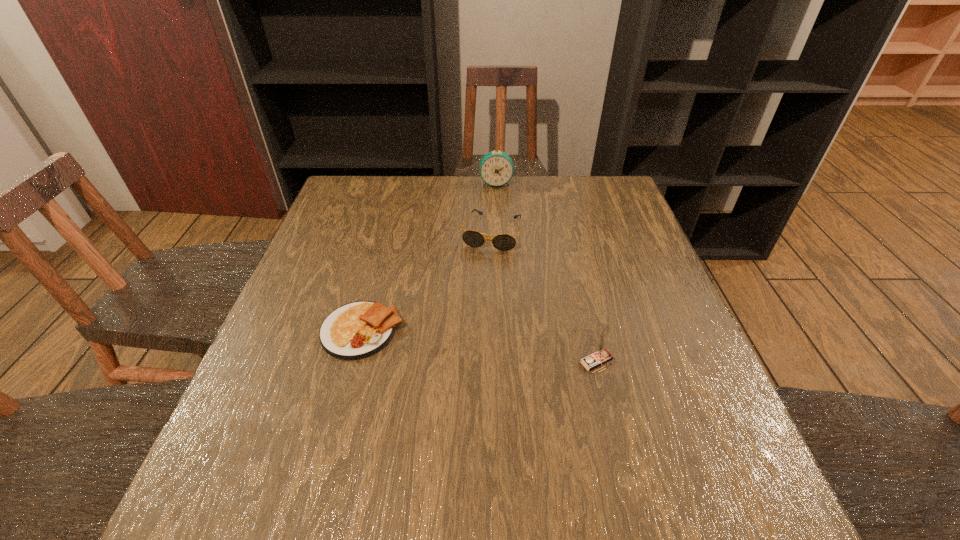
Locate an element on the screen. free area in between the farthest object and the shortest object is located at coordinates (429, 257).

The height and width of the screenshot is (540, 960). Identify the location of unoccupied area between the matchbox and the omelet. (480, 346).

Locate an element on the screen. empty space between the shortest object and the second shortest object is located at coordinates (427, 281).

Locate an element on the screen. This screenshot has width=960, height=540. object that is the third closest to the shortest object is located at coordinates (496, 168).

Identify which object is the third nearest to the matchbox. Please provide its 2D coordinates. Your answer should be formatted as a tuple, i.e. [(x, y)], where the tuple contains the x and y coordinates of a point satisfying the conditions above.

[(496, 168)]

Find the location of `free region that satisfies the following two spatial constraints: 1. on the back side of the second farthest object; 2. on the left side of the leftmost object`. free region that satisfies the following two spatial constraints: 1. on the back side of the second farthest object; 2. on the left side of the leftmost object is located at coordinates (388, 232).

This screenshot has width=960, height=540. In order to click on blank space that satisfies the following two spatial constraints: 1. on the back side of the omelet; 2. on the left side of the alarm clock in this screenshot , I will do `click(401, 183)`.

What are the coordinates of `free spot that satisfies the following two spatial constraints: 1. on the front side of the third nearest object; 2. on the left side of the matchbox` in the screenshot? It's located at (495, 362).